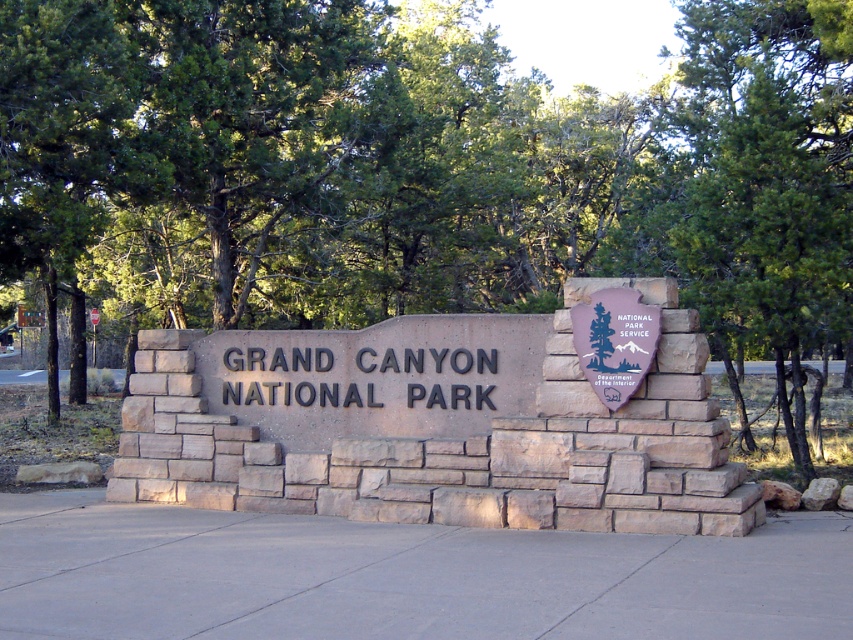
Consider the image. You are standing at the entrance of Grand Canyon National Park and see the gray concrete pavement at center and the purple stone shield at center. Which object is nearer to you?

The gray concrete pavement at center is closer to the viewer than the purple stone shield at center.

You are standing at the entrance of Grand Canyon National Park and want to take a photo of the sign. If you are exactly 9.97 meters away from the point marked at coordinates point (485,554), will you be able to capture the entire sign in your photo without moving closer?

Yes, since you are exactly 9.97 meters away from point (485,554), which is the distance specified in the description, you can capture the entire sign in your photo without moving closer.